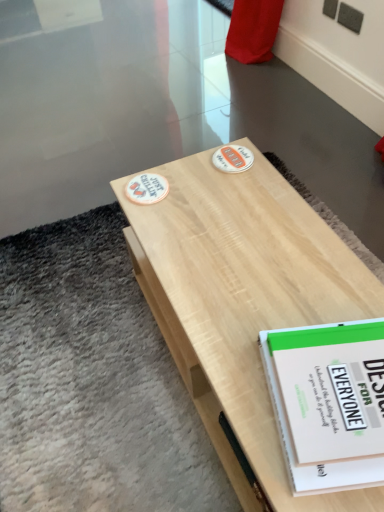
Locate an element on the screen. The height and width of the screenshot is (512, 384). blank space above white paper book at center (from a real-world perspective) is located at coordinates (340, 377).